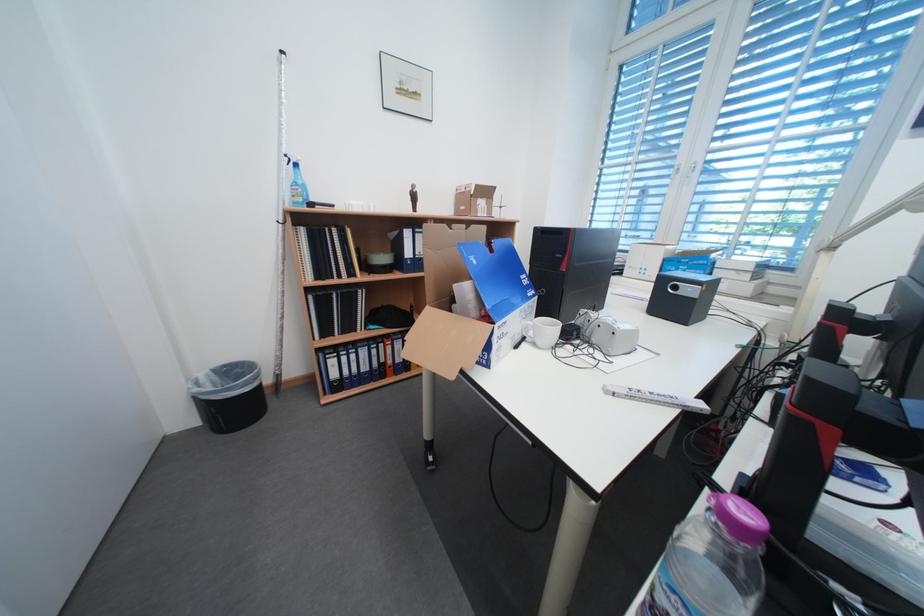
This screenshot has width=924, height=616. Identify the location of purple bottle cap. (738, 515).